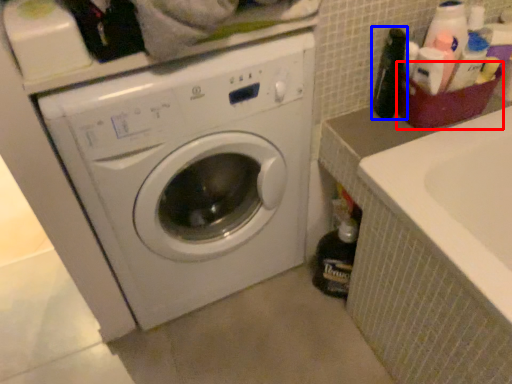
Question: Which object is closer to the camera taking this photo, basket (highlighted by a red box) or bottle (highlighted by a blue box)?

Choices:
 (A) basket
 (B) bottle

Answer: (B)